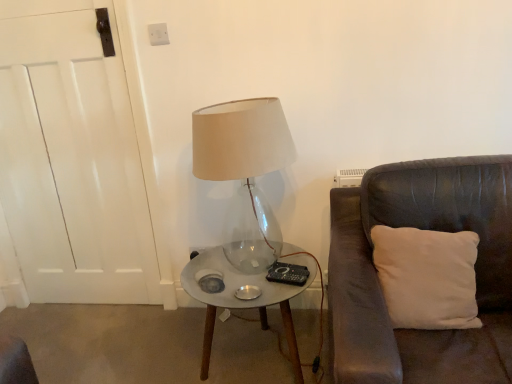
Question: Is clear glass table at center in front of or behind white soft cushion at right in the image?

Choices:
 (A) behind
 (B) front

Answer: (A)

Question: Considering the positions of clear glass table at center and white soft cushion at right in the image, is clear glass table at center wider or thinner than white soft cushion at right?

Choices:
 (A) thin
 (B) wide

Answer: (B)

Question: Considering the real-world distances, which object is farthest from the transparent glass lamp at center?

Choices:
 (A) clear glass table at center
 (B) white soft cushion at right

Answer: (B)

Question: Which of these objects is positioned farthest from the clear glass table at center?

Choices:
 (A) white soft cushion at right
 (B) transparent glass lamp at center

Answer: (B)